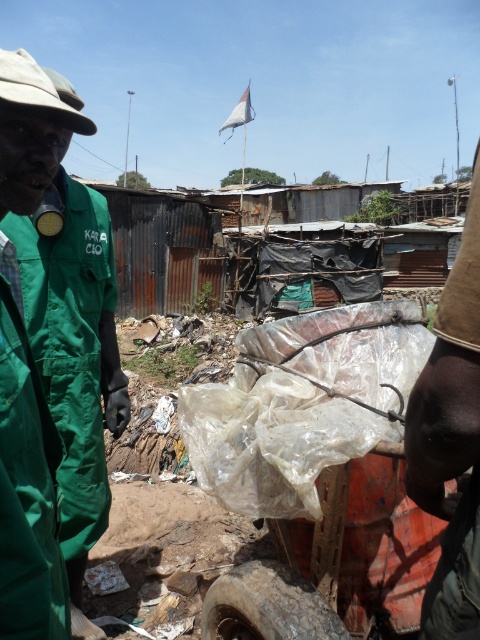
Question: Which of the following is the farthest from the observer?

Choices:
 (A) (235, 614)
 (B) (108, 342)

Answer: (B)

Question: Can you confirm if transparent plastic wagon at center is positioned above green fabric jacket at left?

Choices:
 (A) no
 (B) yes

Answer: (A)

Question: Is transparent plastic wagon at center wider than brown fabric cap at upper right?

Choices:
 (A) yes
 (B) no

Answer: (A)

Question: Which point is farther from the camera taking this photo?

Choices:
 (A) (427, 417)
 (B) (355, 531)
 (C) (249, 595)

Answer: (B)

Question: Based on their relative distances, which object is nearer to the transparent plastic wagon at center?

Choices:
 (A) brown fabric cap at upper right
 (B) rusty rubber tire at lower center
 (C) green fabric jacket at left

Answer: (B)

Question: Can you confirm if transparent plastic wagon at center is smaller than rusty rubber tire at lower center?

Choices:
 (A) no
 (B) yes

Answer: (A)